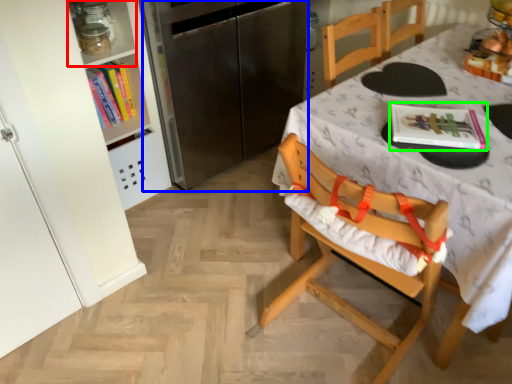
Question: Which object is positioned closest to shelf (highlighted by a red box)? Select from appliance (highlighted by a blue box) and magazine (highlighted by a green box).

Choices:
 (A) appliance
 (B) magazine

Answer: (A)